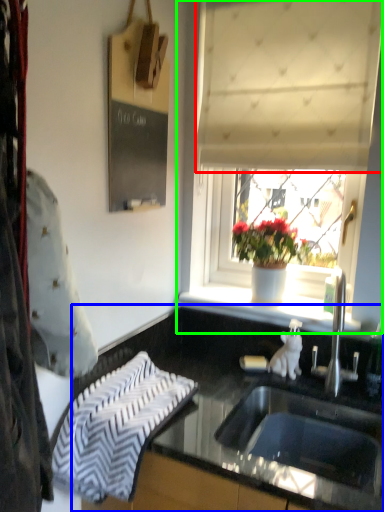
Question: Considering the real-world distances, which object is closest to curtain (highlighted by a red box)? countertop (highlighted by a blue box) or window (highlighted by a green box).

Choices:
 (A) countertop
 (B) window

Answer: (B)